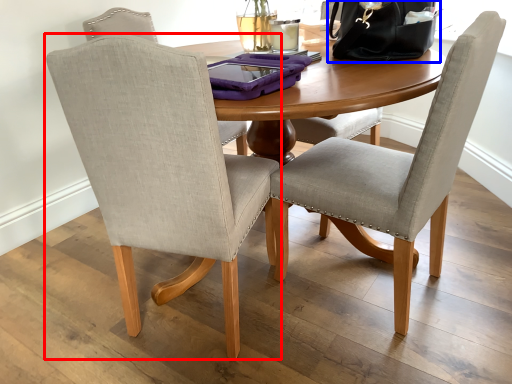
Question: Which point is further to the camera, chair (highlighted by a red box) or handbag (highlighted by a blue box)?

Choices:
 (A) chair
 (B) handbag

Answer: (B)